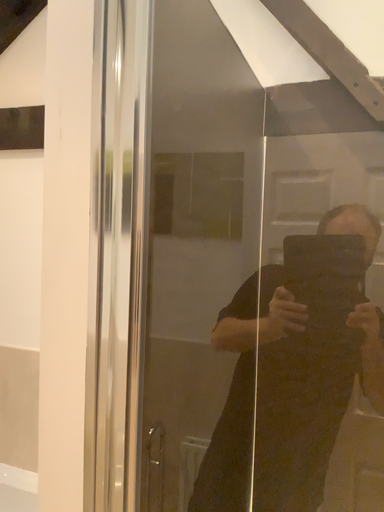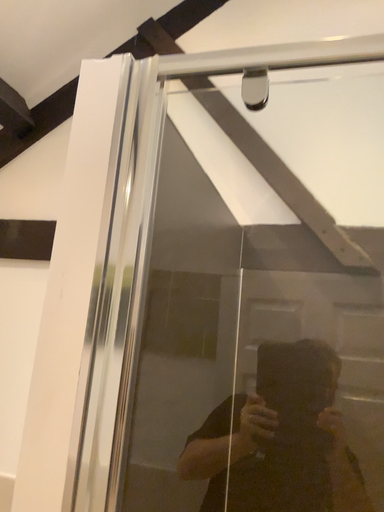
Question: Which way did the camera rotate in the video?

Choices:
 (A) rotated downward
 (B) rotated upward

Answer: (B)